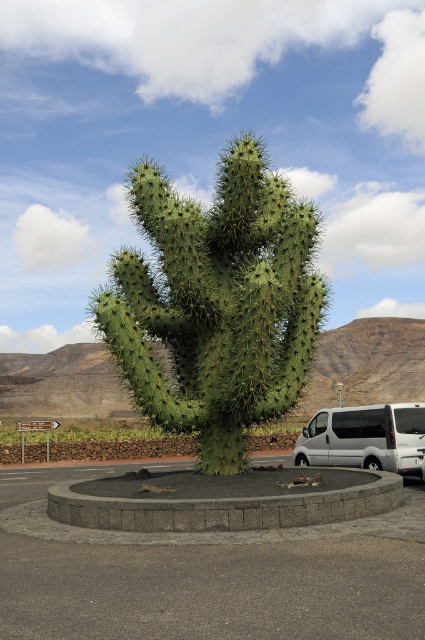
Question: Based on their relative distances, which object is nearer to the gray concrete curb at center?

Choices:
 (A) silver metallic van at center
 (B) green spiny cactus at center

Answer: (B)

Question: Does gray concrete parking lot at center appear on the right side of silver metallic van at center?

Choices:
 (A) no
 (B) yes

Answer: (A)

Question: Which object appears farthest from the camera in this image?

Choices:
 (A) gray concrete parking lot at center
 (B) green spiny cactus at center
 (C) gray concrete curb at center
 (D) silver metallic van at center

Answer: (D)

Question: Where is gray concrete parking lot at center located in relation to silver metallic van at center in the image?

Choices:
 (A) below
 (B) above

Answer: (A)

Question: From the image, what is the correct spatial relationship of gray concrete parking lot at center in relation to gray concrete curb at center?

Choices:
 (A) right
 (B) left

Answer: (A)

Question: Which object is positioned farthest from the gray concrete parking lot at center?

Choices:
 (A) green spiny cactus at center
 (B) gray concrete curb at center
 (C) silver metallic van at center

Answer: (A)